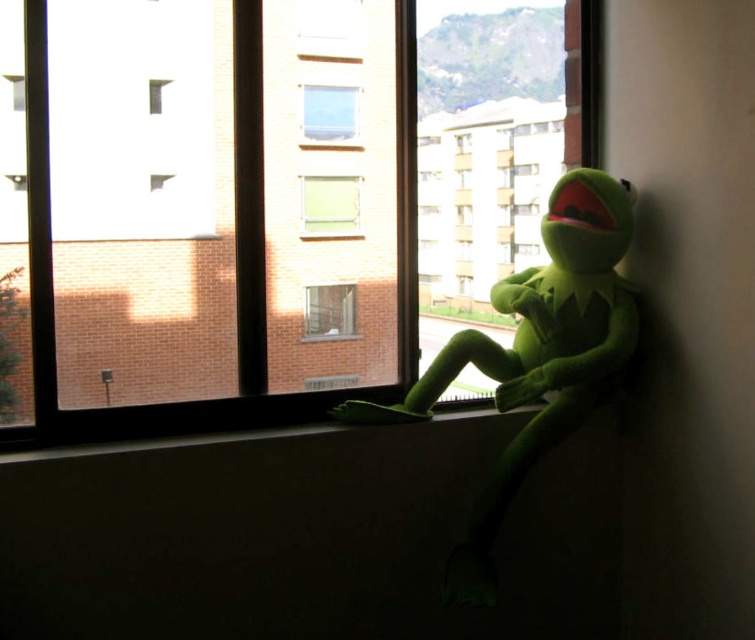
You are standing in the room where the plush toy is placed. You want to place a small decoration between the two points, point (337, 49) and point (341, 115). Which point should the decoration be closer to so that it appears closer to you?

The decoration should be closer to point (337, 49) because it is in front of point (341, 115), so placing it near the front point will make it appear closer to you.

You are standing in the room where the Kermit the Frog plush toy is on the windowsill. You want to place a small plant exactly at the point with coordinates point (492, 348). If you are currently 3 meters away from the windowsill, can you reach the point without moving closer? Please explain your reasoning.

The distance of point (492, 348) from viewer is 2.33 meters. Since you are currently 3 meters away from the windowsill, you are farther than the required distance to reach the point. Therefore, you can reach the point without moving closer because the point is closer to you than your current position.